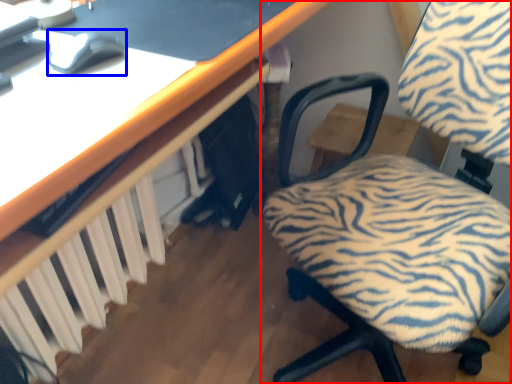
Question: Which object is closer to the camera taking this photo, chair (highlighted by a red box) or mouse (highlighted by a blue box)?

Choices:
 (A) chair
 (B) mouse

Answer: (A)